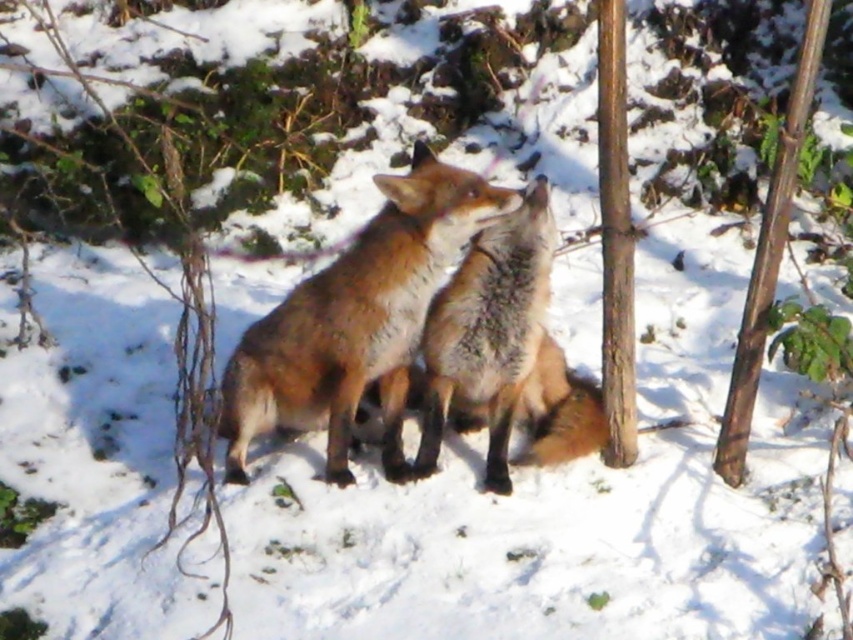
Which is more to the left, smooth brown pole at right or brown wood pole at center?

Positioned to the left is smooth brown pole at right.

This screenshot has width=853, height=640. Describe the element at coordinates (614, 237) in the screenshot. I see `smooth brown pole at right` at that location.

Identify the location of smooth brown pole at right. The width and height of the screenshot is (853, 640). (614, 237).

Based on the photo, is brown fur fox at center further to camera compared to smooth brown pole at right?

No, it is in front of smooth brown pole at right.

Where is `brown fur fox at center`? The height and width of the screenshot is (640, 853). brown fur fox at center is located at coordinates (357, 321).

Between point (323, 339) and point (804, 108), which one is positioned in front?

Point (804, 108) is in front.

Who is shorter, brown fur fox at center or brown wood pole at center?

Standing shorter between the two is brown fur fox at center.

The image size is (853, 640). Identify the location of brown fur fox at center. (357, 321).